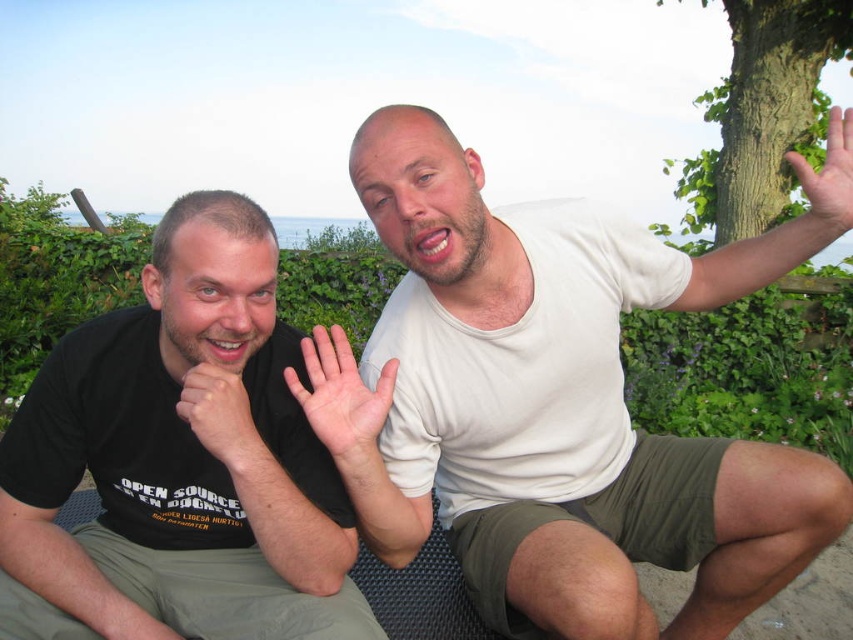
You are a photographer trying to capture a clear shot of both the matte black hand at lower left and the light brown skin at upper right. Which object should you focus on first to ensure both are in focus?

You should focus on the matte black hand at lower left first because it is in front of the light brown skin at upper right, so focusing on the closer object will help both be in focus.

You are a photographer trying to capture a candid shot of the two people in the image. You want to ensure that both the matte black hand at lower left and the light brown skin at upper right are clearly visible in the frame. Given their positions, which object should you focus on first to ensure proper exposure, considering one is closer to the camera?

The matte black hand at lower left is shorter than the light brown skin at upper right, so focusing on the light brown skin at upper right first will ensure proper exposure since it is closer to the camera.